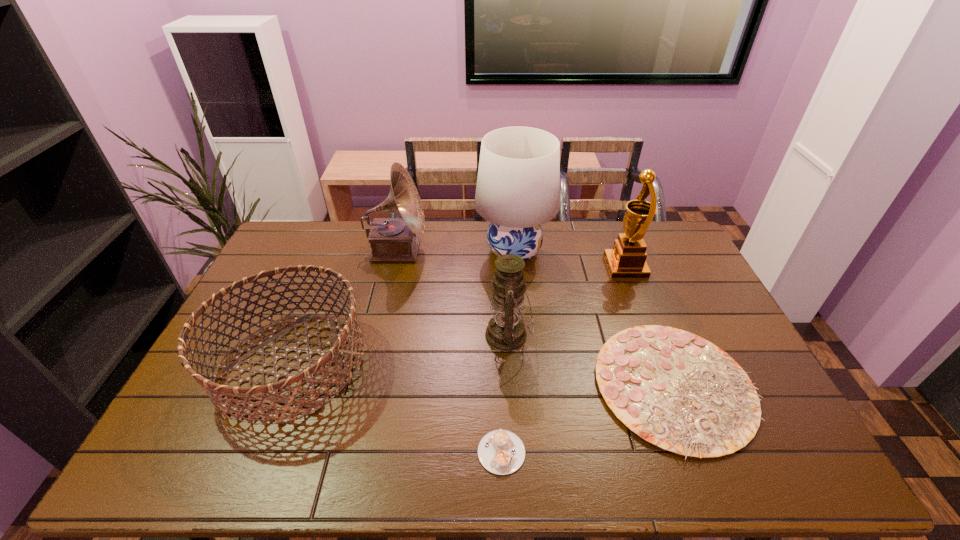
Identify the location of free space at the near right corner. The height and width of the screenshot is (540, 960). (756, 454).

Where is `free space between the cappuccino and the pizza`? The height and width of the screenshot is (540, 960). free space between the cappuccino and the pizza is located at coordinates (588, 419).

Locate an element on the screen. The image size is (960, 540). vacant area that lies between the pizza and the cappuccino is located at coordinates pyautogui.click(x=588, y=419).

This screenshot has height=540, width=960. I want to click on free space between the lampshade and the award, so click(569, 259).

Locate an element on the screen. Image resolution: width=960 pixels, height=540 pixels. vacant area between the phonograph record and the pizza is located at coordinates (537, 319).

This screenshot has width=960, height=540. Identify the location of unoccupied position between the second shortest object and the basket. (483, 375).

Where is `vacant region between the pizza and the fifth tallest object`? This screenshot has width=960, height=540. vacant region between the pizza and the fifth tallest object is located at coordinates (483, 375).

At what (x,y) coordinates should I click in order to perform the action: click on empty space between the phonograph record and the second shortest object. Please return your answer as a coordinate pair (x, y). Looking at the image, I should click on pyautogui.click(x=537, y=319).

The image size is (960, 540). I want to click on object that ranks as the fifth closest to the basket, so click(676, 390).

The width and height of the screenshot is (960, 540). In order to click on object that can be found as the second closest to the oil lamp in this screenshot , I will do `click(518, 185)`.